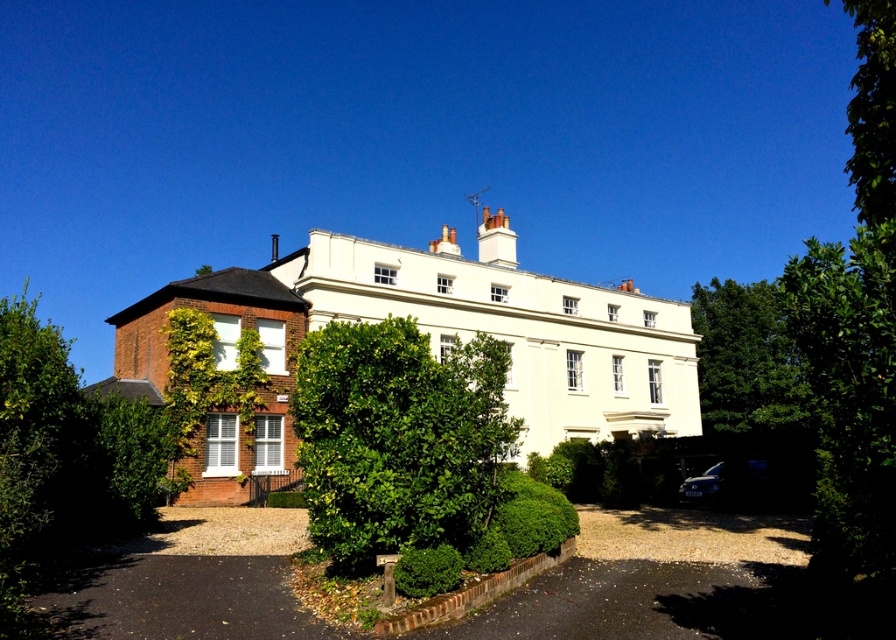
Question: Which of the following is the farthest from the observer?

Choices:
 (A) green leafy bush at center
 (B) green leafy tree at right

Answer: (B)

Question: Does green leafy bush at center appear on the right side of green leafy tree at right?

Choices:
 (A) no
 (B) yes

Answer: (A)

Question: Which point is closer to the camera?

Choices:
 (A) green leafy bush at center
 (B) green leafy tree at right

Answer: (A)

Question: Does green leafy bush at center appear over green leafy tree at right?

Choices:
 (A) no
 (B) yes

Answer: (A)

Question: Which of the following is the farthest from the observer?

Choices:
 (A) click(x=441, y=401)
 (B) click(x=797, y=406)

Answer: (B)

Question: Can you confirm if green leafy bush at center is smaller than green leafy tree at right?

Choices:
 (A) no
 (B) yes

Answer: (B)